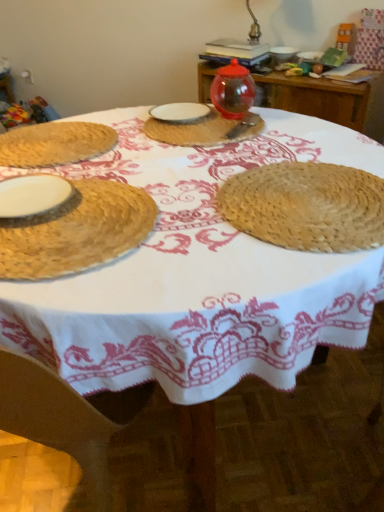
Locate an element on the screen. vacant space in between white ceramic plate at center, positioned as the fourth tableware in front-to-back order, and transparent glass jar at upper center, which appears as the second tableware when viewed from the top is located at coordinates (220, 121).